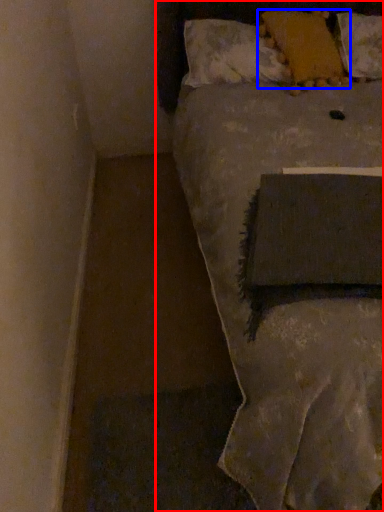
Question: Which of the following is the farthest to the observer, bed (highlighted by a red box) or pillow (highlighted by a blue box)?

Choices:
 (A) bed
 (B) pillow

Answer: (B)